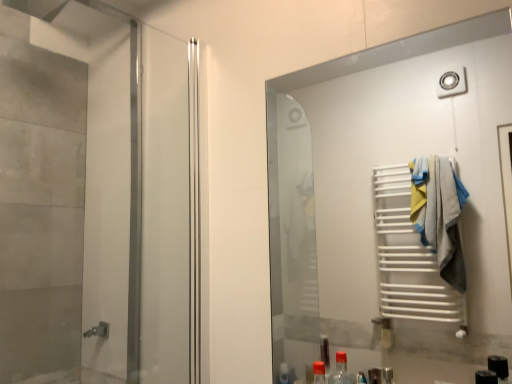
Question: Is matte silver elevator at left oriented towards white matte towel rack at right?

Choices:
 (A) no
 (B) yes

Answer: (B)

Question: Is matte silver elevator at left smaller than white matte towel rack at right?

Choices:
 (A) no
 (B) yes

Answer: (A)

Question: Does matte silver elevator at left have a lesser width compared to white matte towel rack at right?

Choices:
 (A) no
 (B) yes

Answer: (A)

Question: Is matte silver elevator at left positioned in front of white matte towel rack at right?

Choices:
 (A) yes
 (B) no

Answer: (B)

Question: From the image's perspective, is matte silver elevator at left above white matte towel rack at right?

Choices:
 (A) yes
 (B) no

Answer: (A)

Question: Is matte silver elevator at left positioned far away from white matte towel rack at right?

Choices:
 (A) yes
 (B) no

Answer: (A)

Question: Does white matte towel rack at right have a greater width compared to matte silver elevator at left?

Choices:
 (A) yes
 (B) no

Answer: (B)

Question: Could you tell me if white matte towel rack at right is turned towards matte silver elevator at left?

Choices:
 (A) no
 (B) yes

Answer: (A)

Question: Does white matte towel rack at right have a larger size compared to matte silver elevator at left?

Choices:
 (A) yes
 (B) no

Answer: (B)

Question: Is there a large distance between white matte towel rack at right and matte silver elevator at left?

Choices:
 (A) yes
 (B) no

Answer: (A)

Question: Is white matte towel rack at right directly adjacent to matte silver elevator at left?

Choices:
 (A) yes
 (B) no

Answer: (B)

Question: Considering the relative sizes of white matte towel rack at right and matte silver elevator at left in the image provided, is white matte towel rack at right thinner than matte silver elevator at left?

Choices:
 (A) yes
 (B) no

Answer: (A)

Question: In terms of height, does white matte towel rack at right look taller or shorter compared to matte silver elevator at left?

Choices:
 (A) short
 (B) tall

Answer: (A)